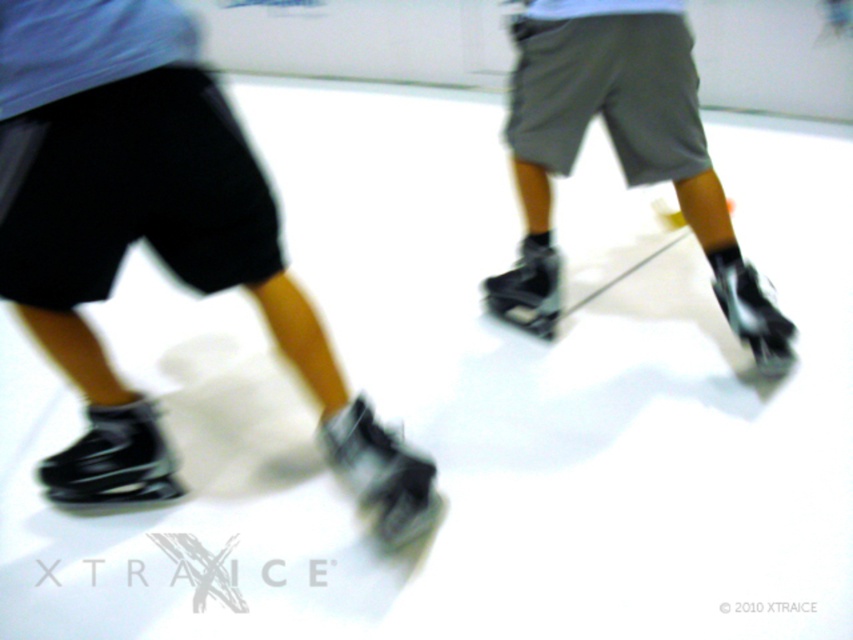
Question: Considering the relative positions of matte black skate shoes at center and black leather roller skate at lower left in the image provided, where is matte black skate shoes at center located with respect to black leather roller skate at lower left?

Choices:
 (A) left
 (B) right

Answer: (B)

Question: Which of the following is the closest to the observer?

Choices:
 (A) (776, 332)
 (B) (136, 460)

Answer: (B)

Question: Is black matte ice skate at lower left above matte black skate shoes at center?

Choices:
 (A) no
 (B) yes

Answer: (A)

Question: Is black matte roller skate at lower center further to the viewer compared to black matte roller skate at center?

Choices:
 (A) no
 (B) yes

Answer: (A)

Question: Among these objects, which one is farthest from the camera?

Choices:
 (A) black matte roller skate at center
 (B) black matte ice skate at lower left

Answer: (A)

Question: Which object is farther from the camera taking this photo?

Choices:
 (A) black leather roller skate at lower left
 (B) black matte roller skate at right
 (C) black matte ice skate at lower left

Answer: (B)